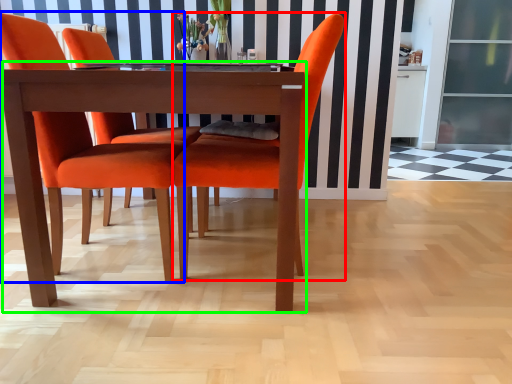
Question: Which object is the farthest from chair (highlighted by a red box)? Choose among these: chair (highlighted by a blue box) or kitchen & dining room table (highlighted by a green box).

Choices:
 (A) chair
 (B) kitchen & dining room table

Answer: (A)